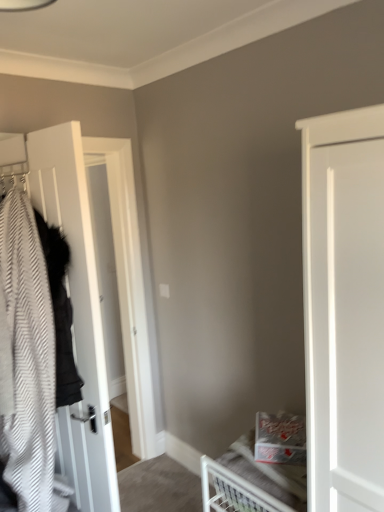
Describe the element at coordinates (262, 467) in the screenshot. I see `white metal bed at lower right` at that location.

Where is `white metal bed at lower right`? The image size is (384, 512). white metal bed at lower right is located at coordinates (262, 467).

What is the approximate height of white wood door at left?

It is 1.76 meters.

Image resolution: width=384 pixels, height=512 pixels. What do you see at coordinates (78, 305) in the screenshot?
I see `white wood door at left` at bounding box center [78, 305].

Find the location of a particular element. white wood door at left is located at coordinates (78, 305).

Based on the photo, what is the approximate width of white wood door at left?

The width of white wood door at left is 4.52 inches.

Where is `white metal bed at lower right`? This screenshot has width=384, height=512. white metal bed at lower right is located at coordinates (262, 467).

Between white wood door at left and white metal bed at lower right, which one appears on the right side from the viewer's perspective?

Positioned to the right is white metal bed at lower right.

Is white wood door at left behind white metal bed at lower right?

Yes, white wood door at left is further from the viewer.

Does point (104, 470) lie in front of point (279, 450)?

No, (104, 470) is further to viewer.

From the image's perspective, is white wood door at left located beneath white metal bed at lower right?

No, from the image's perspective, white wood door at left is not beneath white metal bed at lower right.

From the picture: From a real-world perspective, who is located lower, white wood door at left or white metal bed at lower right?

white metal bed at lower right, from a real-world perspective.

Which object is wider, white wood door at left or white metal bed at lower right?

With larger width is white metal bed at lower right.

Who is shorter, white wood door at left or white metal bed at lower right?

A: white metal bed at lower right is shorter.

Considering the relative sizes of white wood door at left and white metal bed at lower right in the image provided, is white wood door at left bigger than white metal bed at lower right?

Yes.

Is white metal bed at lower right inside white wood door at left?

That's incorrect, white metal bed at lower right is not inside white wood door at left.

Is white wood door at left beside white metal bed at lower right?

white wood door at left and white metal bed at lower right are clearly separated.

Is white wood door at left facing away from white metal bed at lower right?

That's not correct — white wood door at left is not looking away from white metal bed at lower right.

Can you tell me how much white wood door at left and white metal bed at lower right differ in facing direction?

171 degrees.

Identify the location of bed below the white wood door at left (from the image's perspective). (262, 467).

Which is more to the left, white metal bed at lower right or white wood door at left?

Positioned to the left is white wood door at left.

In the image, is white metal bed at lower right positioned in front of or behind white wood door at left?

In the image, white metal bed at lower right appears in front of white wood door at left.

Which is closer to the camera, (286, 479) or (85, 484)?

Point (286, 479) is positioned closer to the camera compared to point (85, 484).

From the image's perspective, between white metal bed at lower right and white wood door at left, who is located below?

white metal bed at lower right is shown below in the image.

From a real-world perspective, is white metal bed at lower right on top of white wood door at left?

No, from a real-world perspective, white metal bed at lower right is not on top of white wood door at left.

Is white metal bed at lower right wider than white wood door at left?

Correct, the width of white metal bed at lower right exceeds that of white wood door at left.

Considering the sizes of objects white metal bed at lower right and white wood door at left in the image provided, who is taller, white metal bed at lower right or white wood door at left?

Standing taller between the two is white wood door at left.

Can you confirm if white metal bed at lower right is smaller than white wood door at left?

Yes.

Is white metal bed at lower right not inside white wood door at left?

white metal bed at lower right is positioned outside white wood door at left.

Would you say white metal bed at lower right is a long distance from white wood door at left?

white metal bed at lower right is actually quite close to white wood door at left.

Could you tell me if white metal bed at lower right is turned towards white wood door at left?

No.

How different are the orientations of white metal bed at lower right and white wood door at left in degrees?

The angular difference between white metal bed at lower right and white wood door at left is 171 degrees.

Measure the distance between white metal bed at lower right and white wood door at left.

64.93 centimeters.

Find the location of a particular element. The width and height of the screenshot is (384, 512). bed on the right of white wood door at left is located at coordinates (262, 467).

Find the location of a particular element. The height and width of the screenshot is (512, 384). door located behind the white metal bed at lower right is located at coordinates (78, 305).

I want to click on door lying on the left of white metal bed at lower right, so click(x=78, y=305).